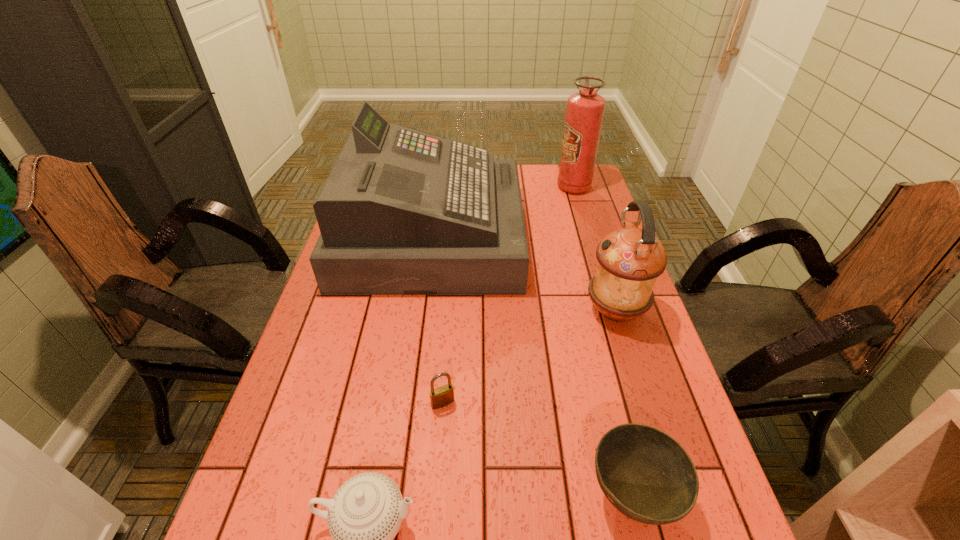
Where is `the third closest object relative to the cash register`? This screenshot has height=540, width=960. the third closest object relative to the cash register is located at coordinates (440, 397).

The width and height of the screenshot is (960, 540). What are the coordinates of `free space that satisfies the following two spatial constraints: 1. on the front-facing side of the padlock; 2. on the left side of the cash register` in the screenshot? It's located at (409, 403).

Identify the location of vacant space that satisfies the following two spatial constraints: 1. on the front-facing side of the cash register; 2. on the left side of the oil lamp. (421, 310).

Find the location of a particular element. This screenshot has width=960, height=540. free spot that satisfies the following two spatial constraints: 1. on the label side of the fire extinguisher; 2. on the front side of the third nearest object is located at coordinates (639, 403).

At what (x,y) coordinates should I click in order to perform the action: click on free location that satisfies the following two spatial constraints: 1. on the front-facing side of the cash register; 2. on the right side of the oil lamp. Please return your answer as a coordinate pair (x, y). Looking at the image, I should click on (421, 310).

In order to click on free point that satisfies the following two spatial constraints: 1. on the label side of the oil lamp; 2. on the right side of the fire extinguisher in this screenshot , I will do `click(612, 310)`.